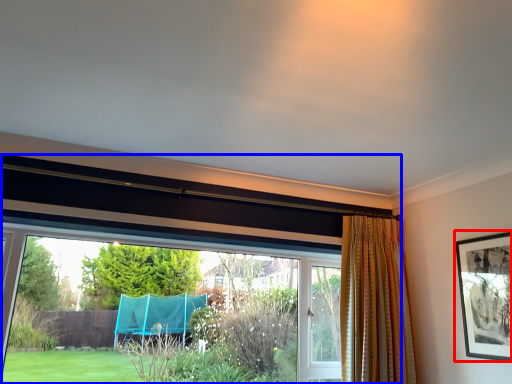
Question: Which object appears farthest to the camera in this image, picture frame (highlighted by a red box) or window (highlighted by a blue box)?

Choices:
 (A) picture frame
 (B) window

Answer: (A)